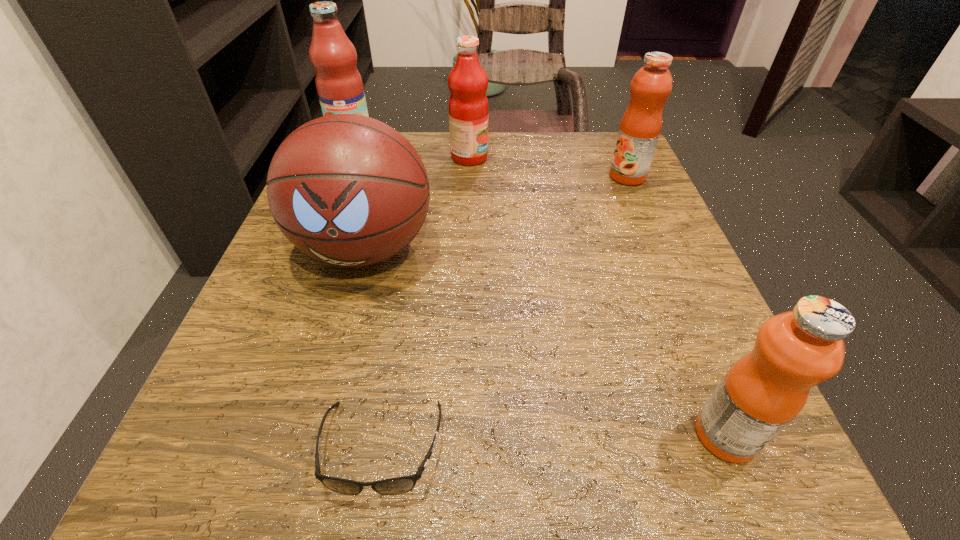
The image size is (960, 540). In order to click on the leftmost fruit juice in this screenshot , I will do `click(339, 85)`.

What are the coordinates of `the second fruit juice from left to right` in the screenshot? It's located at (468, 108).

This screenshot has width=960, height=540. I want to click on basketball, so click(348, 190).

The width and height of the screenshot is (960, 540). I want to click on the nearest fruit juice, so click(763, 391).

Where is `sunglasses`? Image resolution: width=960 pixels, height=540 pixels. sunglasses is located at coordinates (393, 486).

You are a GUI agent. You are given a task and a screenshot of the screen. Output one action in this format:
    pyautogui.click(x=<x>, y=<y>)
    Task: Click on the free point located 0.250m on the front label of the leftmost fruit juice
    
    Given the screenshot: What is the action you would take?
    pyautogui.click(x=320, y=222)

I want to click on blank space located 0.260m on the front label of the second fruit juice from left to right, so click(604, 157).

I want to click on vacant space situated on the front of the fourth farthest object, so click(x=342, y=334).

Locate an element on the screen. vacant area situated 0.350m on the left of the nearest fruit juice is located at coordinates (406, 435).

Where is `fruit juice at the near edge`? This screenshot has width=960, height=540. fruit juice at the near edge is located at coordinates (763, 391).